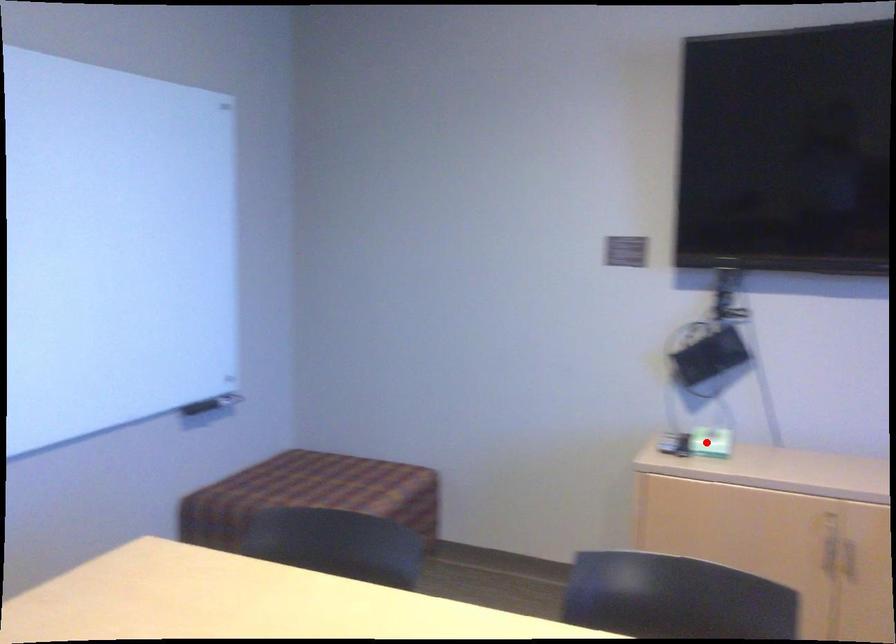
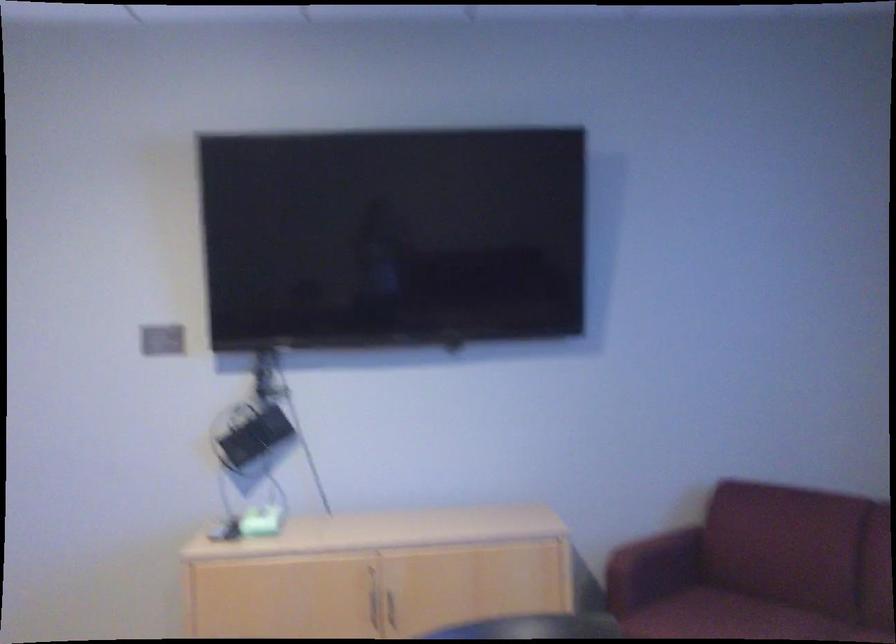
Where in the second image is the point corresponding to the highlighted location from the first image?

(257, 522)